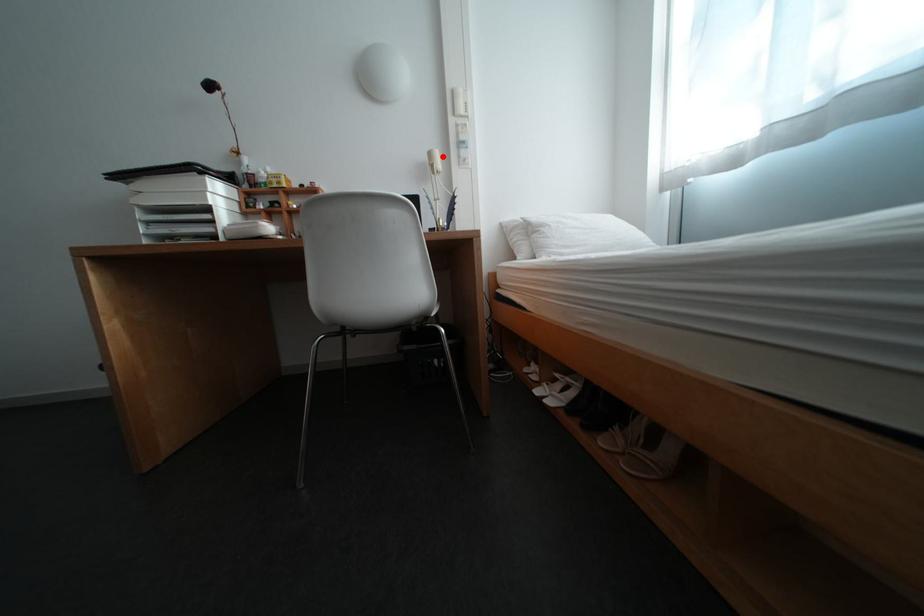
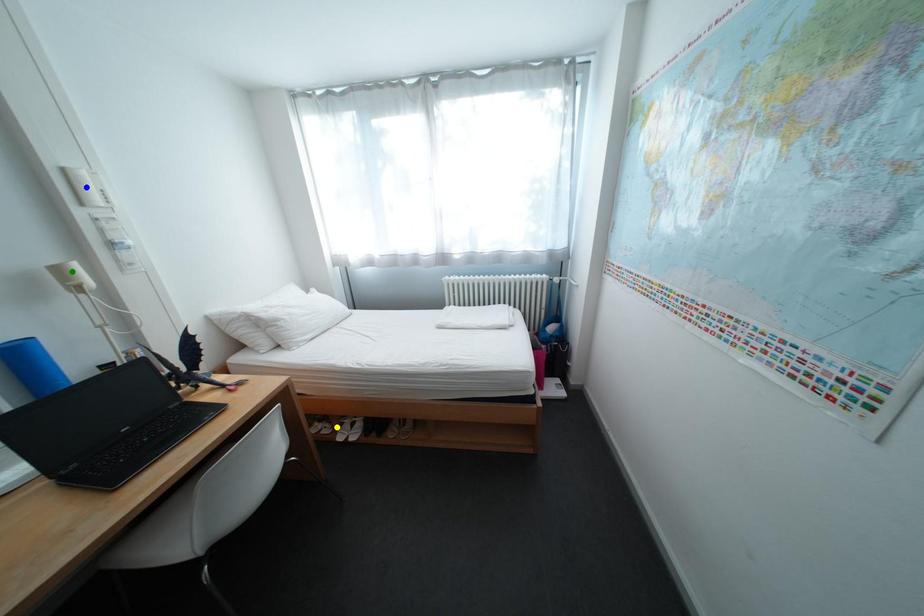
Question: I am providing you with two images of the same scene from different viewpoints. A red point is marked on the first image. You are given multiple points on the second image. Which point in image 2 represents the same 3d spot as the red point in image 1?

Choices:
 (A) yellow point
 (B) blue point
 (C) green point

Answer: (C)